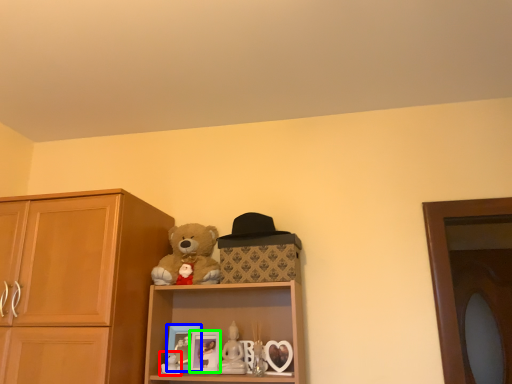
Question: Estimate the real-world distances between objects in this image. Which object is closer to toy (highlighted by a red box), picture frame (highlighted by a blue box) or picture frame (highlighted by a green box)?

Choices:
 (A) picture frame
 (B) picture frame

Answer: (A)